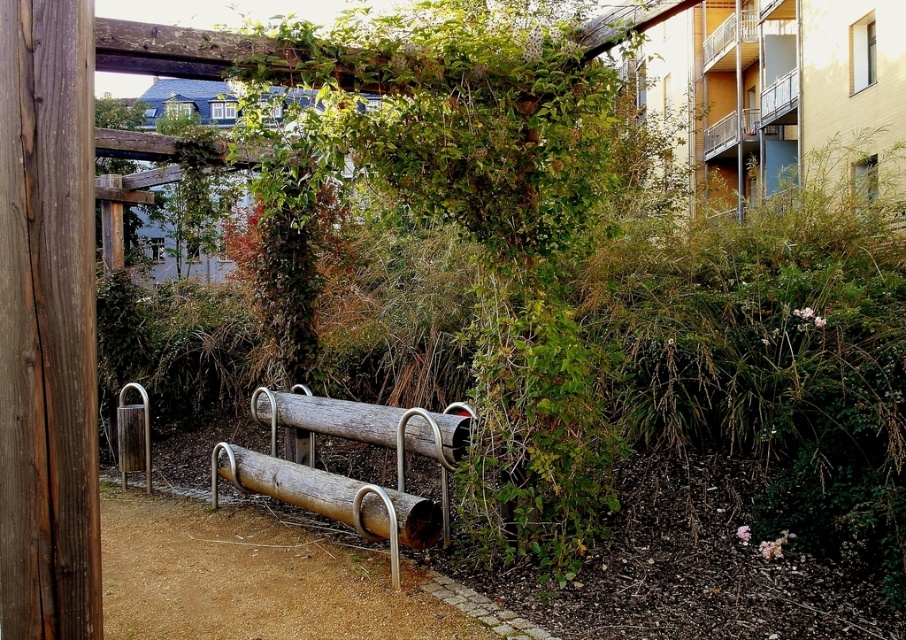
You are standing at the camera position and want to walk to both points in the scene. Which point, point (x=27, y=22) or point (x=365, y=406), will you reach first?

Point (x=27, y=22) is closer to the camera than point (x=365, y=406), so you will reach point (x=27, y=22) first.

You are a gardener standing on the dirt path near the bike rack. You need to place a new decorative stone between the brown wood pole at left and the brown wood log at center. Where should you place it to ensure it is between them horizontally?

The brown wood pole at left is located above the brown wood log at center. To place the decorative stone between them horizontally, position it along the dirt path between the two objects, ensuring it is between their horizontal positions since the pole is vertically above the log.

You are a gardener who needs to place a new decorative stone between the rusty metal log at center and the brown wood log at center. The stone requires 50 centimeters of space to fit. Can you fit the stone between them?

The rusty metal log at center and the brown wood log at center are 48.39 centimeters apart, which is less than the required 50 centimeters. Therefore, the stone cannot be placed between them.